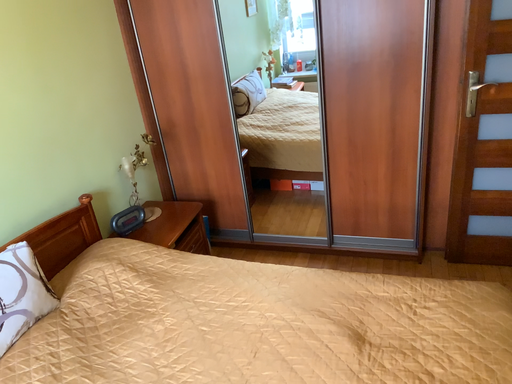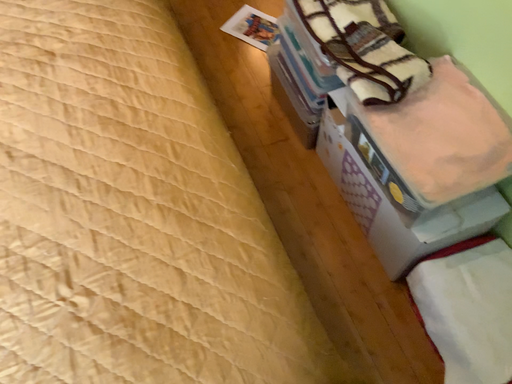
Question: How did the camera likely rotate when shooting the video?

Choices:
 (A) rotated left
 (B) rotated right

Answer: (B)